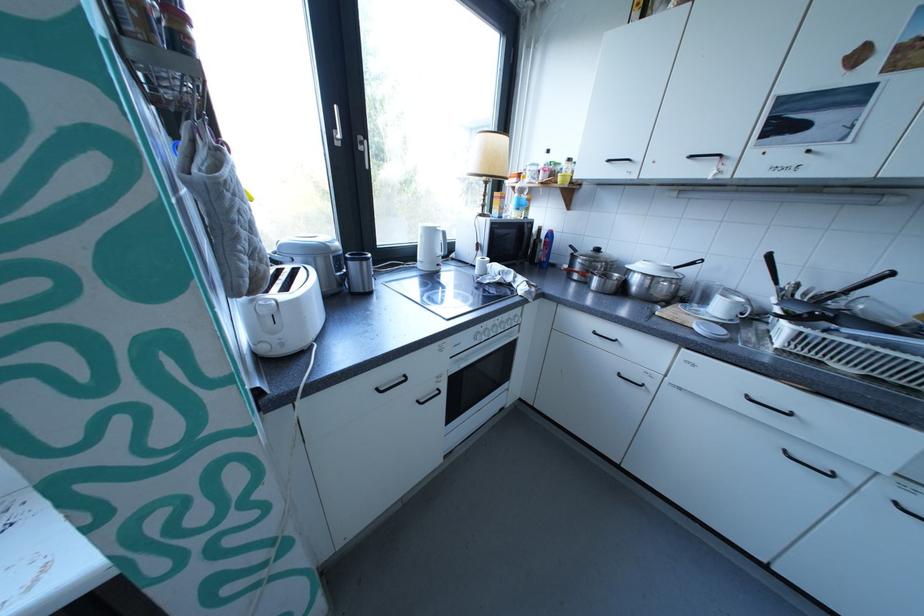
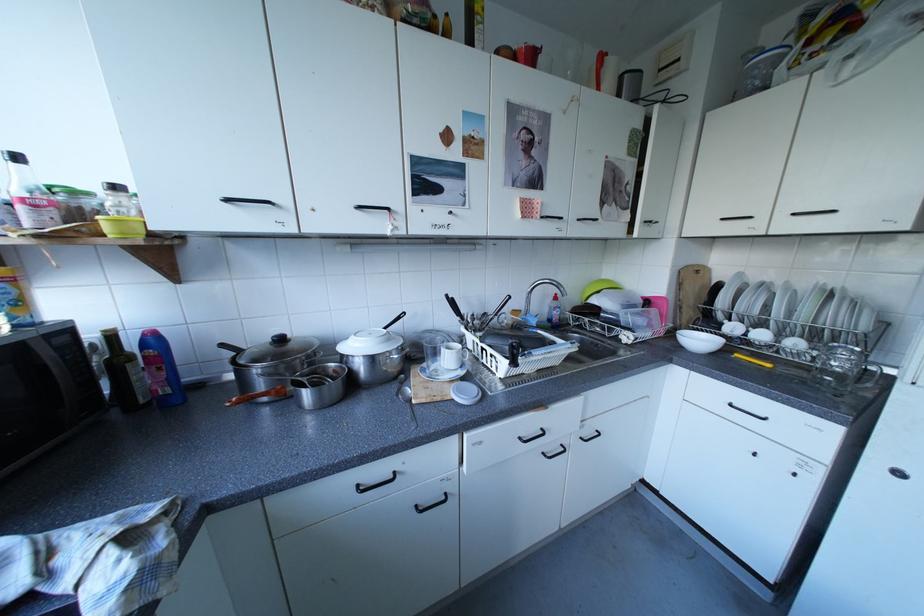
Locate, in the second image, the point that corresponds to pixel 563 235 in the first image.

(165, 339)